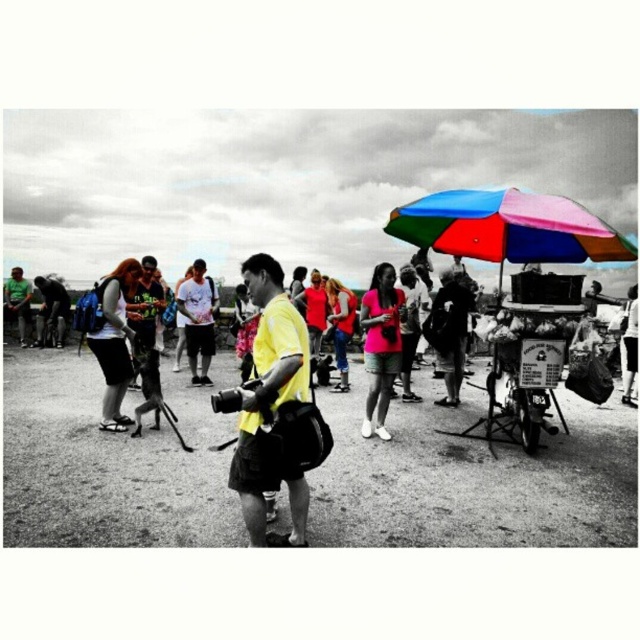
Does point (304, 330) come behind point (369, 396)?

No.

Does point (284, 321) come farther from viewer compared to point (396, 349)?

No, (284, 321) is in front of (396, 349).

Where is `yellow matte shirt at center`? yellow matte shirt at center is located at coordinates click(x=269, y=404).

Who is more forward, (440, 228) or (115, 416)?

Positioned in front is point (440, 228).

Is multicolored fabric umbrella at upper right wider than matte black shorts at lower left?

Indeed, multicolored fabric umbrella at upper right has a greater width compared to matte black shorts at lower left.

Does point (572, 252) lie in front of point (104, 317)?

Yes, point (572, 252) is closer to viewer.

Identify the location of multicolored fabric umbrella at upper right. [508, 227].

Describe the element at coordinates (474, 480) in the screenshot. The width and height of the screenshot is (640, 640). I see `dirt field at center` at that location.

Is dirt field at center wider than multicolored fabric umbrella at upper right?

Yes.

Does point (561, 509) come behind point (435, 228)?

That is False.

Locate an element on the screen. The width and height of the screenshot is (640, 640). dirt field at center is located at coordinates (474, 480).